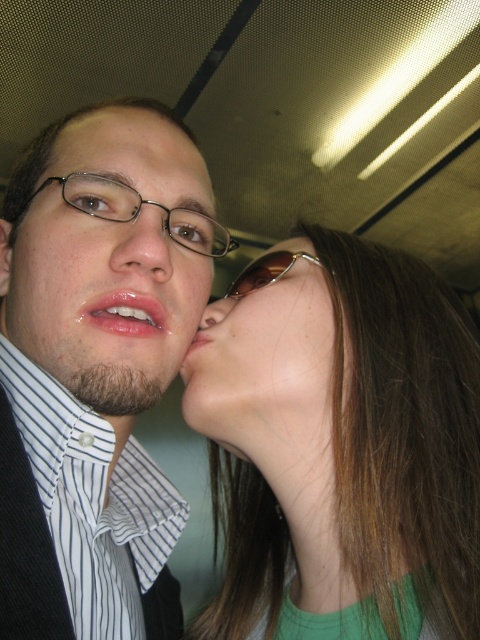
Question: Which of the following is the closest to the observer?

Choices:
 (A) glossy lips at center
 (B) matte skin nose at center

Answer: (A)

Question: Which point is closer to the camera taking this photo?

Choices:
 (A) (78, 150)
 (B) (91, 493)

Answer: (B)

Question: Which object is closer to the camera taking this photo?

Choices:
 (A) matte black face at center
 (B) shiny brown hair at center
 (C) matte skin forehead at upper center

Answer: (B)

Question: Can you confirm if shiny brown hair at center is smaller than matte skin nose at center?

Choices:
 (A) no
 (B) yes

Answer: (A)

Question: Does matte glass nose at center appear on the right side of matte pink lips at center?

Choices:
 (A) yes
 (B) no

Answer: (B)

Question: From the image, what is the correct spatial relationship of shiny brown hair at center in relation to matte skin forehead at upper center?

Choices:
 (A) right
 (B) left

Answer: (A)